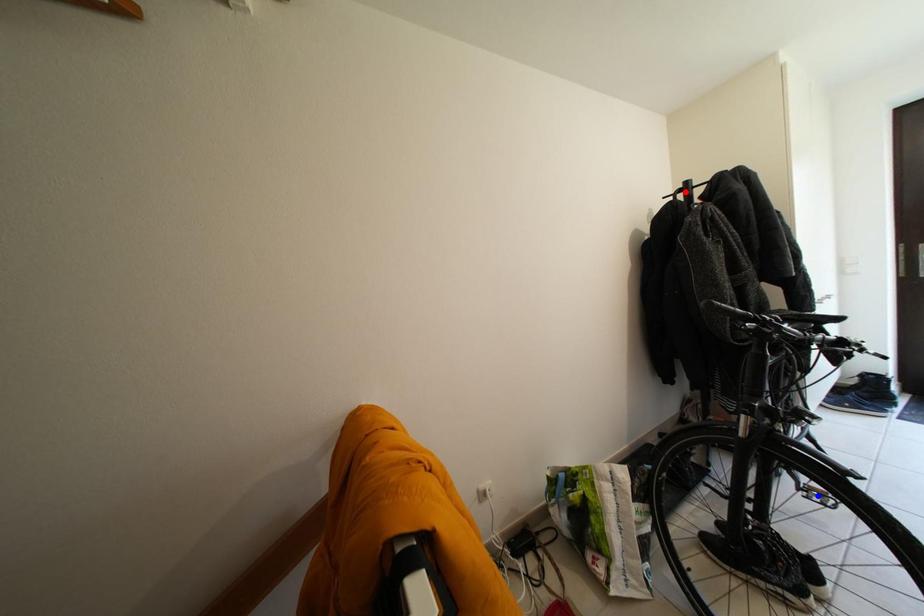
Question: Which of the two points in the image is closer to the camera?

Choices:
 (A) Blue point is closer.
 (B) Red point is closer.

Answer: (A)